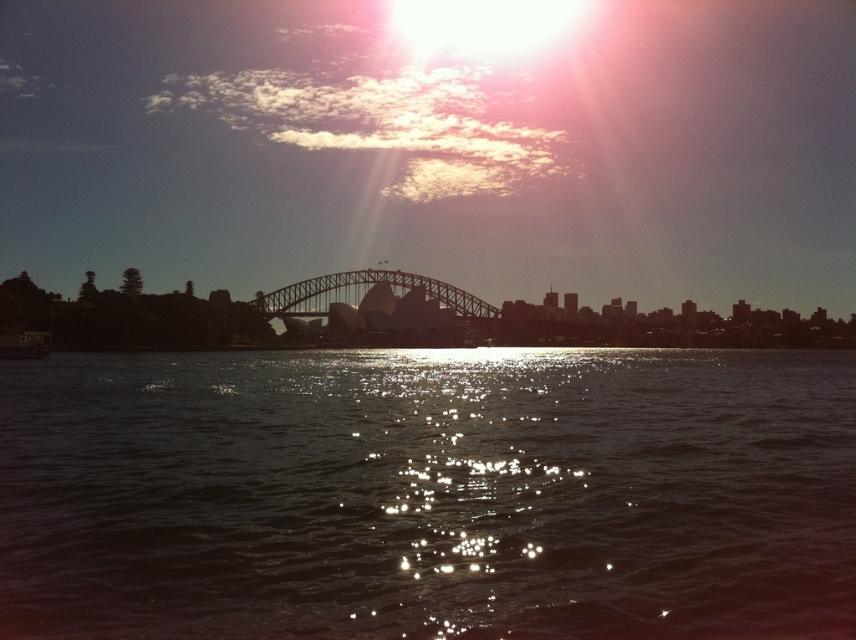
You are a photographer planning to capture the Sydney Opera House and the dark gray metallic bridge at center from a boat on the glistening water at center. Based on their positions, which object is closer to the photographer when facing the scene?

The glistening water at center is to the right of the dark gray metallic bridge at center, so the dark gray metallic bridge at center is closer to the photographer when facing the scene.

Based on the photo, you are a tourist standing at the point labeled as point (429, 493) in the image. You want to take a photo of the Sydney Opera House and Sydney Harbour Bridge. Which direction should you face to ensure both landmarks are in your view?

You should face towards the left of the point (429, 493) to capture both the Sydney Opera House and Sydney Harbour Bridge in your photo.